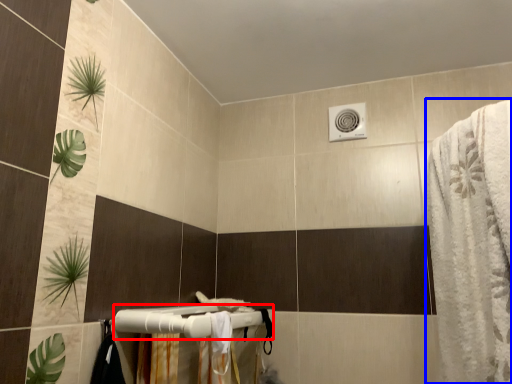
Question: Which object is further to the camera taking this photo, towel bar (highlighted by a red box) or bath towel (highlighted by a blue box)?

Choices:
 (A) towel bar
 (B) bath towel

Answer: (A)